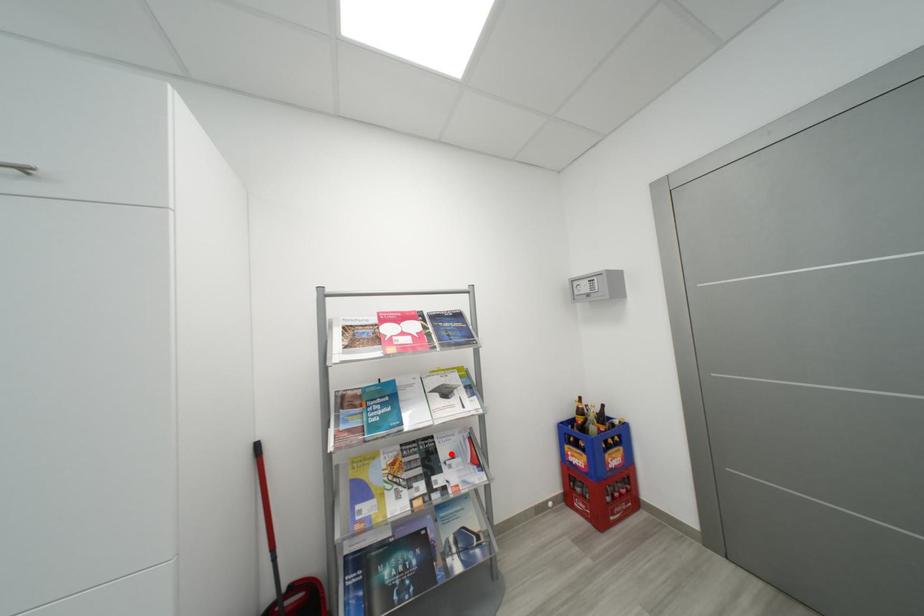
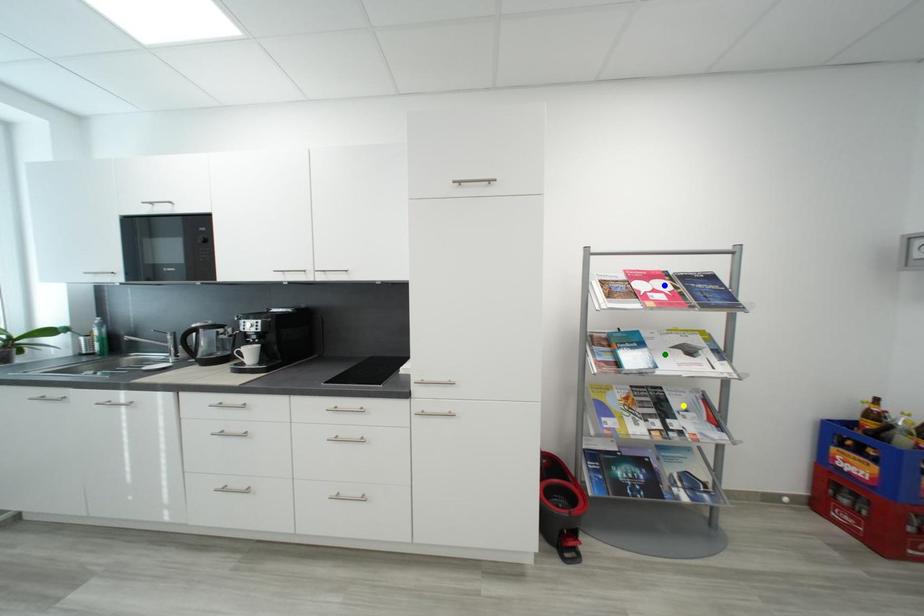
Question: I am providing you with two images of the same scene from different viewpoints. A red point is marked on the first image. You are given multiple points on the second image. Which spot in image 2 lines up with the point in image 1?

Choices:
 (A) green point
 (B) yellow point
 (C) blue point

Answer: (B)